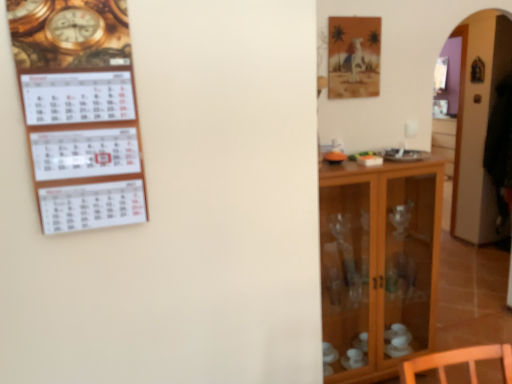
Locate an element on the screen. The height and width of the screenshot is (384, 512). transparent glass cabinet at right is located at coordinates (478, 124).

Measure the distance between point (45, 73) and camera.

3.80 feet.

Where is `wooden cabinet at right`? The image size is (512, 384). wooden cabinet at right is located at coordinates (378, 263).

The width and height of the screenshot is (512, 384). What do you see at coordinates (354, 57) in the screenshot?
I see `matte brown picture frame at upper right` at bounding box center [354, 57].

Where is `transparent glass cabinet at right`? The height and width of the screenshot is (384, 512). transparent glass cabinet at right is located at coordinates (478, 124).

From the image's perspective, is white paper calendar at left located above or below matte brown picture frame at upper right?

Based on their image positions, white paper calendar at left is located beneath matte brown picture frame at upper right.

Does white paper calendar at left have a lesser width compared to matte brown picture frame at upper right?

No.

Is white paper calendar at left in front of or behind matte brown picture frame at upper right in the image?

white paper calendar at left is positioned closer to the viewer than matte brown picture frame at upper right.

The width and height of the screenshot is (512, 384). Identify the location of shelf that appears below the white paper calendar at left (from the image's perspective). (378, 263).

Is wooden cabinet at right positioned with its back to white paper calendar at left?

No.

Is point (364, 263) farther from viewer compared to point (120, 127)?

That is True.

Is wooden cabinet at right positioned beyond the bounds of white paper calendar at left?

Indeed, wooden cabinet at right is completely outside white paper calendar at left.

Is wooden cabinet at right positioned with its back to matte brown picture frame at upper right?

No, wooden cabinet at right's orientation is not away from matte brown picture frame at upper right.

Would you say wooden cabinet at right is to the left or to the right of matte brown picture frame at upper right in the picture?

Clearly, wooden cabinet at right is on the right of matte brown picture frame at upper right in the image.

What's the angular difference between wooden cabinet at right and matte brown picture frame at upper right's facing directions?

The facing directions of wooden cabinet at right and matte brown picture frame at upper right are 0.00285 degrees apart.

Is wooden cabinet at right beside matte brown picture frame at upper right?

No, wooden cabinet at right is not making contact with matte brown picture frame at upper right.

The image size is (512, 384). Find the location of `shelf below the white paper calendar at left (from a real-world perspective)`. shelf below the white paper calendar at left (from a real-world perspective) is located at coordinates (x=378, y=263).

Which object is positioned more to the left, white paper calendar at left or wooden cabinet at right?

From the viewer's perspective, white paper calendar at left appears more on the left side.

From the image's perspective, which is above, white paper calendar at left or wooden cabinet at right?

white paper calendar at left, from the image's perspective.

Based on the photo, is white paper calendar at left far away from wooden cabinet at right?

Yes.

Where is `glass door on the right of matte brown picture frame at upper right`? This screenshot has width=512, height=384. glass door on the right of matte brown picture frame at upper right is located at coordinates (478, 124).

Which of these two, transparent glass cabinet at right or matte brown picture frame at upper right, stands taller?

transparent glass cabinet at right is taller.

Is transparent glass cabinet at right aimed at matte brown picture frame at upper right?

No.

Does transparent glass cabinet at right have a larger size compared to matte brown picture frame at upper right?

Yes, transparent glass cabinet at right is bigger than matte brown picture frame at upper right.

Considering the relative positions of transparent glass cabinet at right and wooden cabinet at right in the image provided, is transparent glass cabinet at right to the left of wooden cabinet at right from the viewer's perspective?

No.

From the image's perspective, is transparent glass cabinet at right over wooden cabinet at right?

Yes, from the image's perspective, transparent glass cabinet at right is above wooden cabinet at right.

In order to click on glass door lying above the wooden cabinet at right (from the image's perspective) in this screenshot , I will do `click(478, 124)`.

Considering the relative sizes of matte brown picture frame at upper right and transparent glass cabinet at right in the image provided, is matte brown picture frame at upper right shorter than transparent glass cabinet at right?

Correct, matte brown picture frame at upper right is not as tall as transparent glass cabinet at right.

Which of these two, matte brown picture frame at upper right or transparent glass cabinet at right, is smaller?

matte brown picture frame at upper right.

Does point (336, 59) come closer to viewer compared to point (478, 81)?

Yes.

At what (x,y) coordinates should I click in order to perform the action: click on bulletin board lying in front of the matte brown picture frame at upper right. Please return your answer as a coordinate pair (x, y). The width and height of the screenshot is (512, 384). Looking at the image, I should click on (84, 149).

Image resolution: width=512 pixels, height=384 pixels. I want to click on bulletin board positioned vertically above the wooden cabinet at right (from a real-world perspective), so click(x=84, y=149).

Looking at the image, which one is located closer to matte brown picture frame at upper right, white paper calendar at left or transparent glass cabinet at right?

white paper calendar at left is closer to matte brown picture frame at upper right.

From the image, which object appears to be nearer to wooden cabinet at right, matte brown picture frame at upper right or transparent glass cabinet at right?

matte brown picture frame at upper right.

Estimate the real-world distances between objects in this image. Which object is closer to wooden cabinet at right, matte brown picture frame at upper right or white paper calendar at left?

matte brown picture frame at upper right is closer to wooden cabinet at right.

In the scene shown: When comparing their distances from wooden cabinet at right, does transparent glass cabinet at right or matte brown picture frame at upper right seem closer?

matte brown picture frame at upper right is positioned closer to the anchor wooden cabinet at right.

Considering their positions, is wooden cabinet at right positioned closer to white paper calendar at left than transparent glass cabinet at right?

wooden cabinet at right.

From the image, which object appears to be nearer to matte brown picture frame at upper right, white paper calendar at left or wooden cabinet at right?

wooden cabinet at right is positioned closer to the anchor matte brown picture frame at upper right.

When comparing their distances from matte brown picture frame at upper right, does transparent glass cabinet at right or wooden cabinet at right seem further?

transparent glass cabinet at right is positioned further to the anchor matte brown picture frame at upper right.

Considering their positions, is transparent glass cabinet at right positioned closer to wooden cabinet at right than white paper calendar at left?

white paper calendar at left lies closer to wooden cabinet at right than the other object.

In order to click on shelf between white paper calendar at left and transparent glass cabinet at right from left to right in this screenshot , I will do `click(378, 263)`.

Locate an element on the screen. picture frame between white paper calendar at left and transparent glass cabinet at right is located at coordinates (354, 57).

Where is `shelf located between matte brown picture frame at upper right and transparent glass cabinet at right in the left-right direction`? The image size is (512, 384). shelf located between matte brown picture frame at upper right and transparent glass cabinet at right in the left-right direction is located at coordinates (378, 263).

Where is `picture frame between white paper calendar at left and wooden cabinet at right`? The image size is (512, 384). picture frame between white paper calendar at left and wooden cabinet at right is located at coordinates (354, 57).